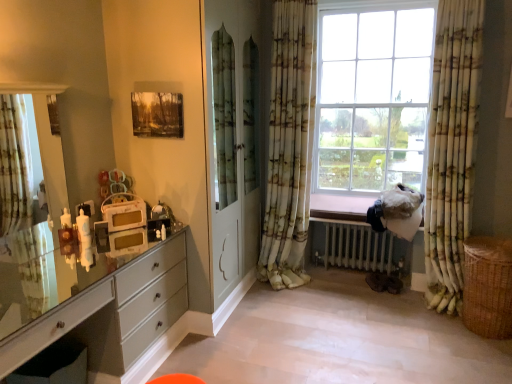
Locate an element on the screen. space that is in front of white metallic radiator at lower right is located at coordinates (372, 304).